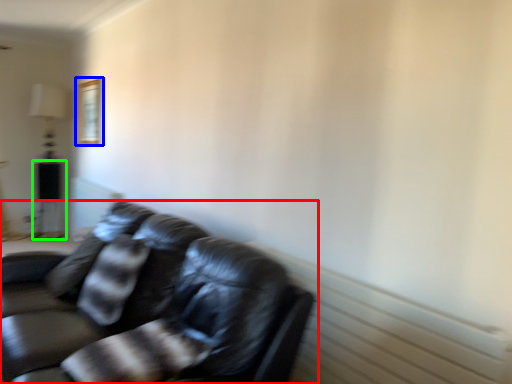
Question: Based on their relative distances, which object is farther from studio couch (highlighted by a red box)? Choose from picture frame (highlighted by a blue box) and table (highlighted by a green box).

Choices:
 (A) picture frame
 (B) table

Answer: (B)